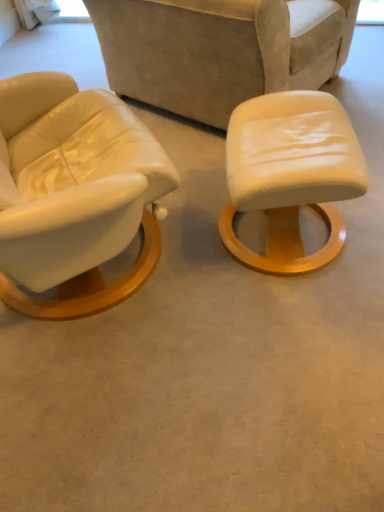
The width and height of the screenshot is (384, 512). I want to click on free point below matte white stool at center (from a real-world perspective), so click(x=301, y=238).